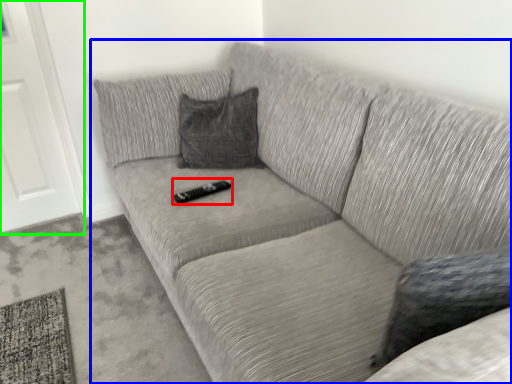
Question: Estimate the real-world distances between objects in this image. Which object is farther from remote (highlighted by a red box), studio couch (highlighted by a blue box) or door (highlighted by a green box)?

Choices:
 (A) studio couch
 (B) door

Answer: (B)